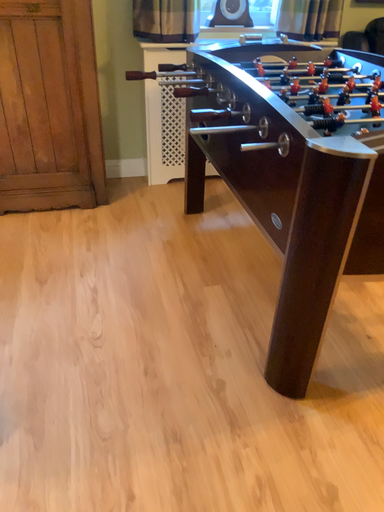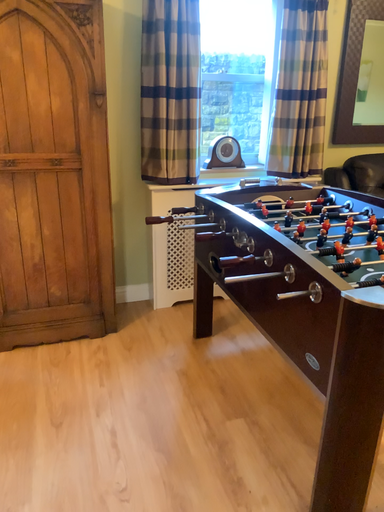
Question: How did the camera likely rotate when shooting the video?

Choices:
 (A) rotated upward
 (B) rotated downward

Answer: (A)